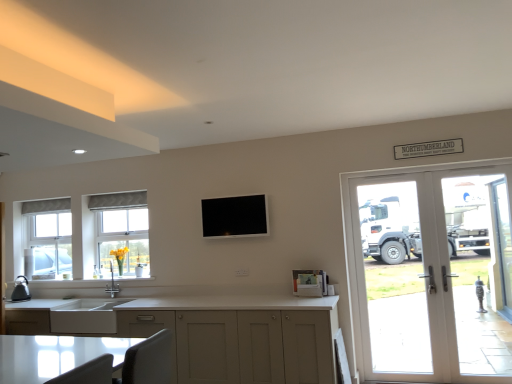
Question: Is clear glass window at left, which is the second window in right-to-left order, to the right of white textured window at center, acting as the first window starting from the right, from the viewer's perspective?

Choices:
 (A) no
 (B) yes

Answer: (A)

Question: From the image's perspective, is clear glass window at left, the 2th window viewed from the front, beneath white textured window at center, acting as the first window starting from the right?

Choices:
 (A) no
 (B) yes

Answer: (B)

Question: From the image's perspective, is clear glass window at left, the first window in the left-to-right sequence, on top of white textured window at center, positioned as the first window in front-to-back order?

Choices:
 (A) no
 (B) yes

Answer: (A)

Question: Is clear glass window at left, which is the second window in right-to-left order, facing away from white textured window at center, which is the second window from left to right?

Choices:
 (A) yes
 (B) no

Answer: (B)

Question: Is clear glass window at left, which ranks as the first window in back-to-front order, aimed at white textured window at center, positioned as the first window in front-to-back order?

Choices:
 (A) yes
 (B) no

Answer: (B)

Question: Considering the relative sizes of clear glass window at left, which ranks as the first window in back-to-front order, and white textured window at center, acting as the first window starting from the right, in the image provided, is clear glass window at left, which ranks as the first window in back-to-front order, thinner than white textured window at center, acting as the first window starting from the right,?

Choices:
 (A) no
 (B) yes

Answer: (B)

Question: Considering the relative positions of matte white cabinets at lower center and clear glass window at left, the first window in the left-to-right sequence, in the image provided, is matte white cabinets at lower center behind clear glass window at left, the first window in the left-to-right sequence,?

Choices:
 (A) yes
 (B) no

Answer: (B)

Question: From a real-world perspective, is matte white cabinets at lower center over clear glass window at left, which is the second window in right-to-left order?

Choices:
 (A) no
 (B) yes

Answer: (A)

Question: From the image's perspective, is matte white cabinets at lower center under clear glass window at left, which ranks as the first window in back-to-front order?

Choices:
 (A) no
 (B) yes

Answer: (B)

Question: Does matte white cabinets at lower center have a greater height compared to clear glass window at left, which is the second window in right-to-left order?

Choices:
 (A) no
 (B) yes

Answer: (B)

Question: Is matte white cabinets at lower center oriented away from clear glass window at left, which is the second window in right-to-left order?

Choices:
 (A) no
 (B) yes

Answer: (A)

Question: Is clear glass window at left, which ranks as the first window in back-to-front order, completely or partially inside matte white cabinets at lower center?

Choices:
 (A) yes
 (B) no

Answer: (B)

Question: Considering the relative sizes of white matte sink at lower left and white glass screen door at right, which ranks as the 2th screen door in back-to-front order, in the image provided, is white matte sink at lower left bigger than white glass screen door at right, which ranks as the 2th screen door in back-to-front order,?

Choices:
 (A) yes
 (B) no

Answer: (B)